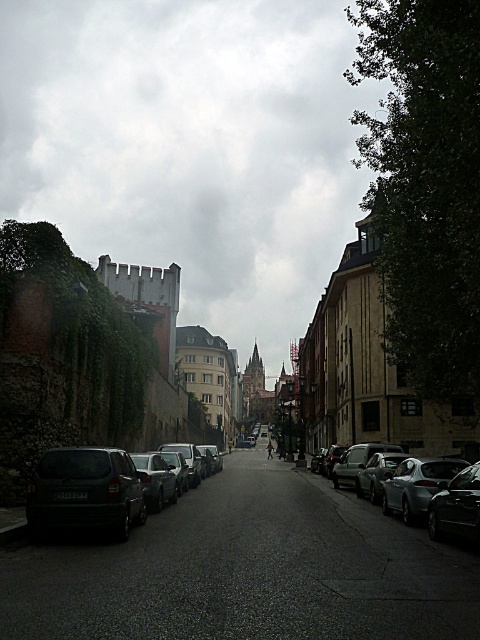
Is shiny silver sedan at right further to camera compared to shiny black car at lower right?

Yes.

Does point (441, 484) come behind point (452, 481)?

Yes, point (441, 484) is farther from viewer.

Where is `shiny silver sedan at right`? shiny silver sedan at right is located at coordinates (416, 484).

Looking at this image, does dark gray matte car at lower left have a greater width compared to shiny silver sedan at center?

Correct, the width of dark gray matte car at lower left exceeds that of shiny silver sedan at center.

Is point (68, 525) positioned before point (377, 497)?

Yes, it is.

Is point (118, 500) closer to viewer compared to point (387, 452)?

That is True.

You are a GUI agent. You are given a task and a screenshot of the screen. Output one action in this format:
    pyautogui.click(x=<x>, y=<y>)
    Task: Click on the dark gray matte car at lower left
    This screenshot has height=640, width=480.
    Given the screenshot: What is the action you would take?
    pyautogui.click(x=84, y=492)

Can you confirm if shiny black car at lower right is smaller than silver metallic car at center?

No, shiny black car at lower right is not smaller than silver metallic car at center.

Who is more forward, (459, 500) or (163, 465)?

Positioned in front is point (459, 500).

Which is behind, point (444, 529) or point (154, 468)?

The point (154, 468) is more distant.

Locate an element on the screen. shiny black car at lower right is located at coordinates (456, 508).